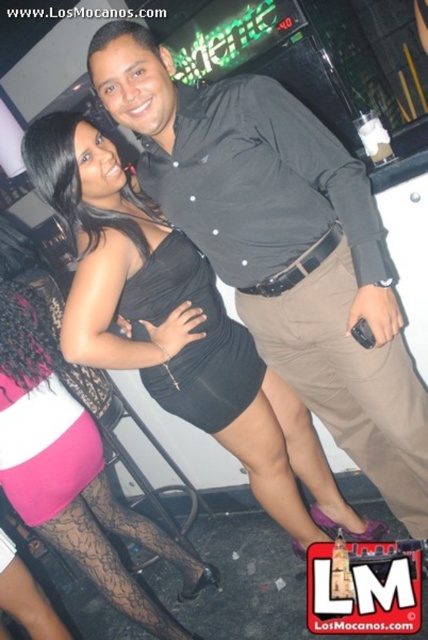
Can you confirm if black lace stockings at lower left is positioned to the right of black satin dress at center?

Incorrect, black lace stockings at lower left is not on the right side of black satin dress at center.

Does black lace stockings at lower left have a lesser height compared to black satin dress at center?

Incorrect, black lace stockings at lower left's height does not fall short of black satin dress at center's.

The width and height of the screenshot is (428, 640). What are the coordinates of `black lace stockings at lower left` in the screenshot? It's located at (73, 472).

Is black lace stockings at lower left taller than brown leather belt at center?

Correct, black lace stockings at lower left is much taller as brown leather belt at center.

Between black lace stockings at lower left and brown leather belt at center, which one appears on the left side from the viewer's perspective?

Positioned to the left is black lace stockings at lower left.

Between point (62, 470) and point (412, 460), which one is positioned in front?

Positioned in front is point (412, 460).

The height and width of the screenshot is (640, 428). In order to click on black lace stockings at lower left in this screenshot , I will do `click(73, 472)`.

Does brown leather belt at center have a greater height compared to black satin dress at center?

Correct, brown leather belt at center is much taller as black satin dress at center.

Which is in front, point (398, 456) or point (192, 413)?

Point (192, 413)

Is point (369, 438) positioned in front of point (157, 317)?

No, it is not.

Where is `brown leather belt at center`? The image size is (428, 640). brown leather belt at center is located at coordinates (350, 381).